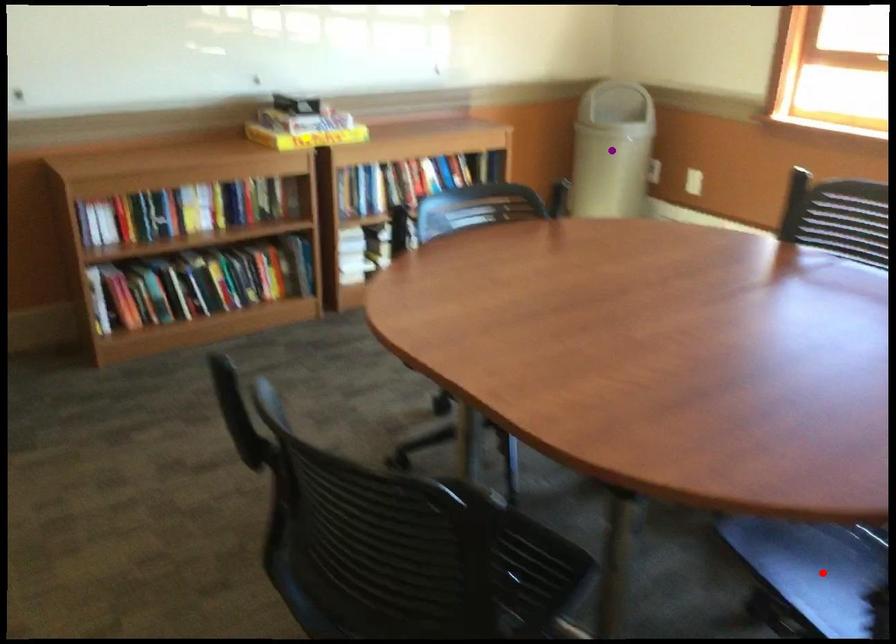
Order these from nearest to farthest:
A) yellow point
B) purple point
C) red point

red point → yellow point → purple point